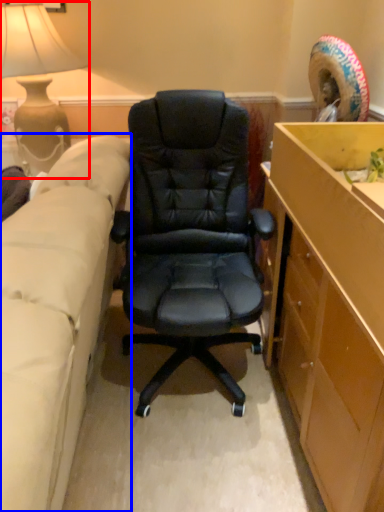
Question: Which of the following is the farthest to the observer, lamp (highlighted by a red box) or studio couch (highlighted by a blue box)?

Choices:
 (A) lamp
 (B) studio couch

Answer: (A)